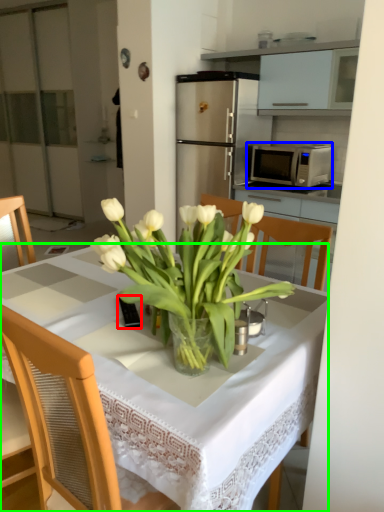
Question: Estimate the real-world distances between objects in this image. Which object is closer to corded phone (highlighted by a red box), microwave oven (highlighted by a blue box) or desk (highlighted by a green box)?

Choices:
 (A) microwave oven
 (B) desk

Answer: (B)